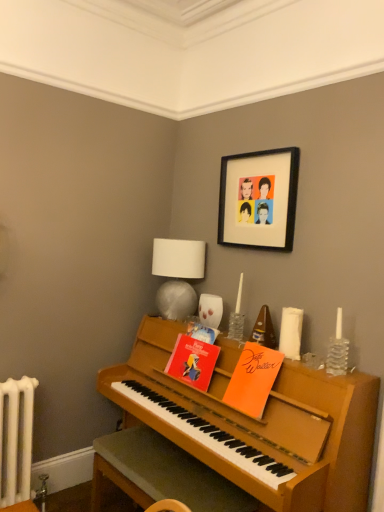
Find the location of a particular element. The height and width of the screenshot is (512, 384). empty space that is ontop of black matte picture frame at upper center (from a real-world perspective) is located at coordinates (266, 146).